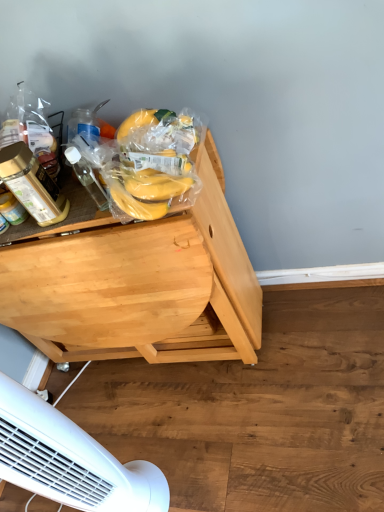
Where is `vacant area that lies between yellow matte bananas at center, which is counted as the 1th food, starting from the bottom, and translucent plastic bottle at left, which appears as the 1th bottle when viewed from the left`? vacant area that lies between yellow matte bananas at center, which is counted as the 1th food, starting from the bottom, and translucent plastic bottle at left, which appears as the 1th bottle when viewed from the left is located at coordinates (87, 215).